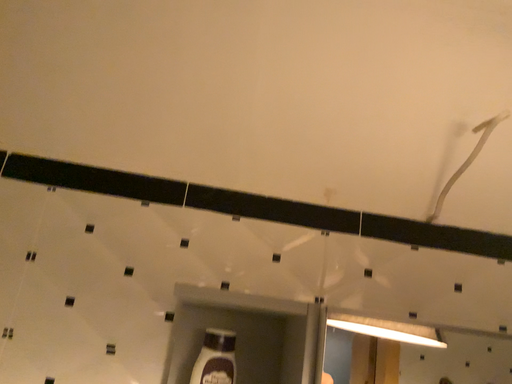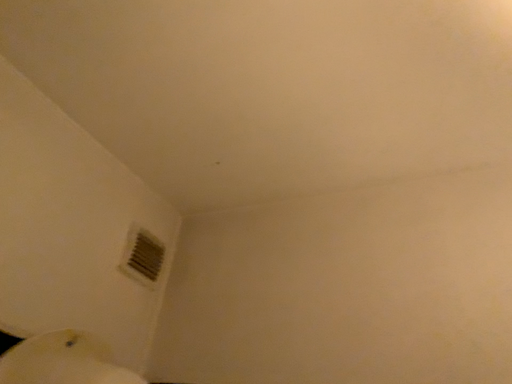
Question: How did the camera likely rotate when shooting the video?

Choices:
 (A) rotated left
 (B) rotated right

Answer: (A)